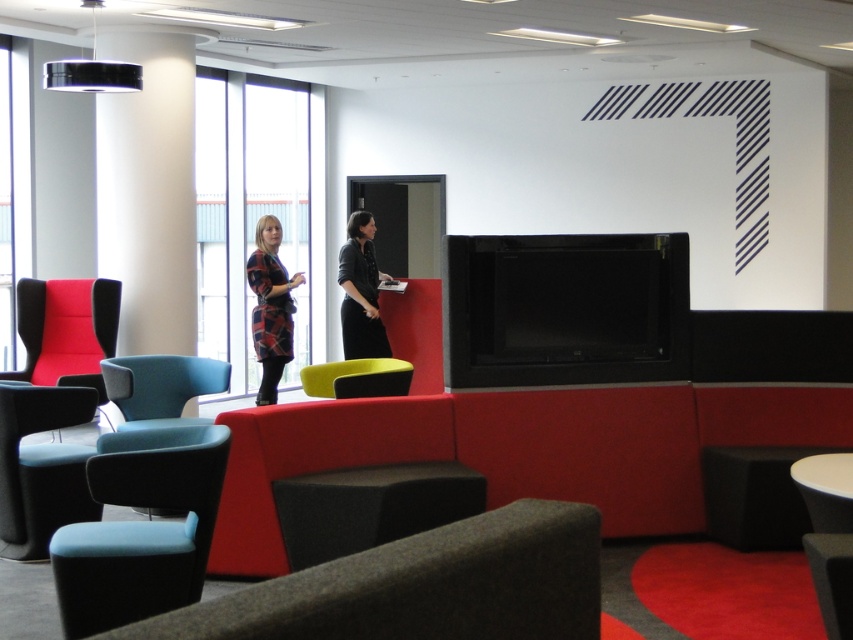
You are an interior designer planning to place a new coffee table in the open space between the matte blue armchair at lower left and the yellow fabric chair at center. Given that the coffee table must be at least 1 meter wide to accommodate items like books and drinks, can the space between these two chairs comfortably fit such a table?

The matte blue armchair at lower left is larger in size than the yellow fabric chair at center, but the exact distance between them isn not specified in the provided description. Therefore, it is uncertain whether the space is wide enough for a 1 meter wide coffee table.

You are an office worker who needs to choose between the teal fabric chair at center and the yellow fabric chair at center for a meeting. Which chair has a wider seat to accommodate your laptop?

The teal fabric chair at center has a wider seat than the yellow fabric chair at center, so it can better accommodate your laptop.